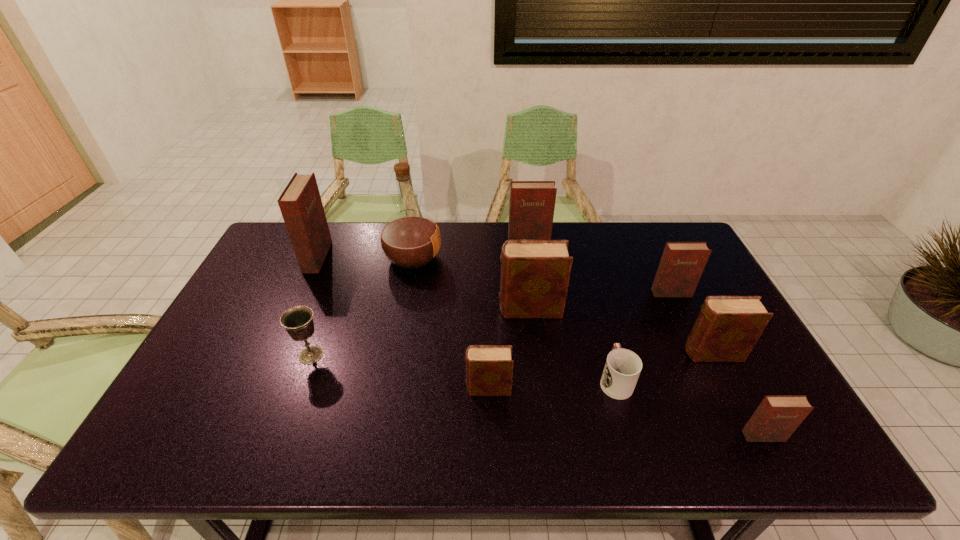
The height and width of the screenshot is (540, 960). I want to click on vacant space situated 0.270m on the front cover of the tallest diary, so click(406, 257).

The image size is (960, 540). Find the location of `blank area located 0.100m on the spine side of the biggest brown diary`. blank area located 0.100m on the spine side of the biggest brown diary is located at coordinates (465, 309).

I want to click on vacant region located 0.300m on the spine side of the biggest brown diary, so click(x=396, y=309).

Find the location of a particular element. free spot located 0.240m on the spine side of the biggest brown diary is located at coordinates (417, 309).

I want to click on vacant space situated 0.360m on the front cover of the second biggest reddish-brown diary, so click(540, 321).

Locate an element on the screen. blank area located on the front cover of the third farthest reddish-brown diary is located at coordinates (692, 338).

At what (x,y) coordinates should I click in order to perform the action: click on free spot located on the spine side of the second smallest brown diary. Please return your answer as a coordinate pair (x, y). Looking at the image, I should click on (647, 353).

The width and height of the screenshot is (960, 540). Find the location of `vacant space located on the spine side of the second smallest brown diary`. vacant space located on the spine side of the second smallest brown diary is located at coordinates (561, 353).

Find the location of a particular element. The width and height of the screenshot is (960, 540). free region located on the spine side of the second smallest brown diary is located at coordinates (538, 353).

Identify the location of free spot located 0.140m on the front of the ninth object from right to left. (289, 415).